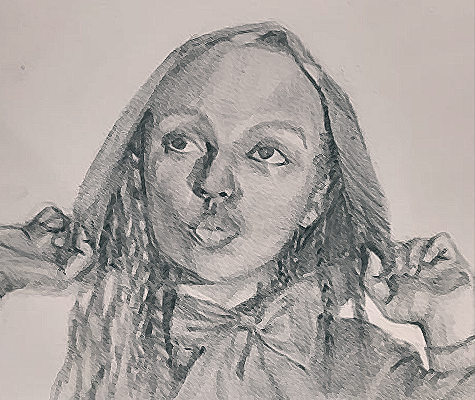
Where is `hood`? hood is located at coordinates (351, 138).